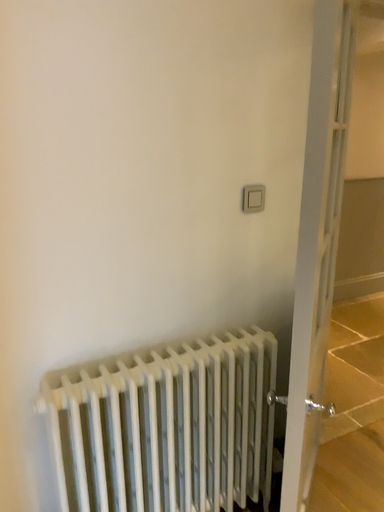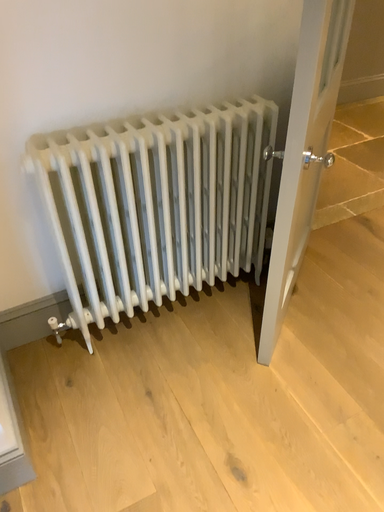
Question: Which way did the camera rotate in the video?

Choices:
 (A) rotated downward
 (B) rotated upward

Answer: (A)